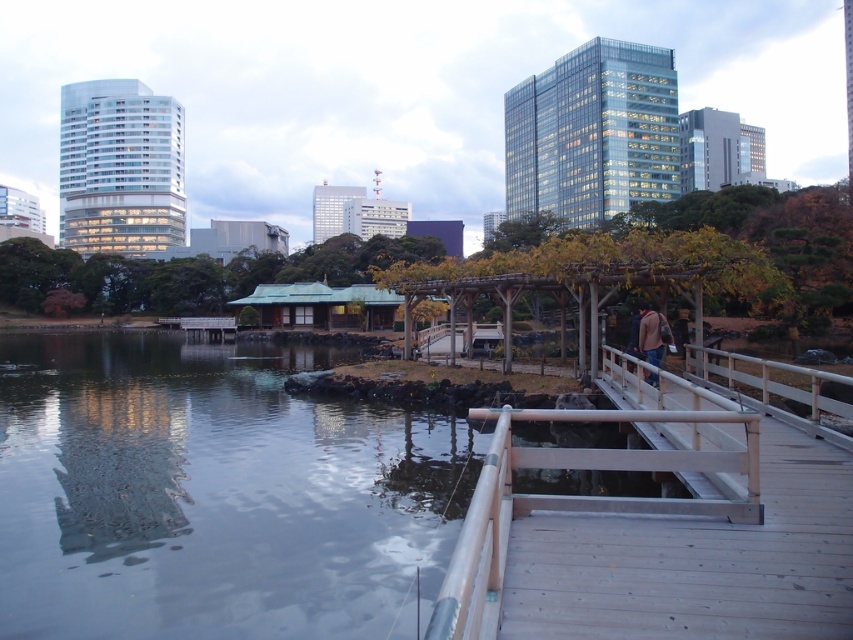
You are standing at the wooden bridge and want to take a photo of both the traditional building and the pergolas. Which point, point (705, 483) or point (660, 339), should you focus on to ensure both elements are in the same frame?

You should focus on point (660, 339) because it is farther from the camera than point (705, 483), allowing both the traditional building and the pergolas to be captured in the same frame.